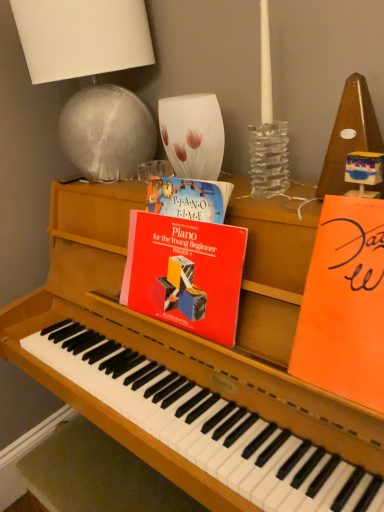
Question: Is orange matte paper at right, placed as the second paperback book when sorted from left to right, directly adjacent to white fabric lampshade at upper left?

Choices:
 (A) yes
 (B) no

Answer: (B)

Question: From a real-world perspective, is orange matte paper at right, which is counted as the 1th paperback book, starting from the right, positioned over white fabric lampshade at upper left based on gravity?

Choices:
 (A) yes
 (B) no

Answer: (B)

Question: Is orange matte paper at right, which is counted as the 1th paperback book, starting from the right, to the right of white fabric lampshade at upper left from the viewer's perspective?

Choices:
 (A) yes
 (B) no

Answer: (A)

Question: Could you tell me if orange matte paper at right, placed as the second paperback book when sorted from left to right, is turned towards white fabric lampshade at upper left?

Choices:
 (A) no
 (B) yes

Answer: (A)

Question: From the image's perspective, would you say orange matte paper at right, placed as the second paperback book when sorted from left to right, is shown under white fabric lampshade at upper left?

Choices:
 (A) no
 (B) yes

Answer: (B)

Question: From a real-world perspective, is orange matte paper at right, placed as the second paperback book when sorted from left to right, located beneath white fabric lampshade at upper left?

Choices:
 (A) yes
 (B) no

Answer: (A)

Question: Can you see orange matte paper at right, placed as the second paperback book when sorted from left to right, touching red matte piano book at center, marked as the first paperback book in a left-to-right arrangement?

Choices:
 (A) yes
 (B) no

Answer: (B)

Question: Is orange matte paper at right, which is counted as the 1th paperback book, starting from the right, not inside red matte piano book at center, which is the second paperback book in right-to-left order?

Choices:
 (A) no
 (B) yes

Answer: (B)

Question: From a real-world perspective, does orange matte paper at right, placed as the second paperback book when sorted from left to right, stand above red matte piano book at center, which is the second paperback book in right-to-left order?

Choices:
 (A) yes
 (B) no

Answer: (A)

Question: From the image's perspective, is orange matte paper at right, placed as the second paperback book when sorted from left to right, on top of red matte piano book at center, marked as the first paperback book in a left-to-right arrangement?

Choices:
 (A) no
 (B) yes

Answer: (A)

Question: Is orange matte paper at right, which is counted as the 1th paperback book, starting from the right, further to camera compared to red matte piano book at center, marked as the first paperback book in a left-to-right arrangement?

Choices:
 (A) no
 (B) yes

Answer: (A)

Question: Is orange matte paper at right, placed as the second paperback book when sorted from left to right, wider than red matte piano book at center, which is the second paperback book in right-to-left order?

Choices:
 (A) no
 (B) yes

Answer: (B)

Question: Is white fabric lampshade at upper left at the right side of orange matte paper at right, placed as the second paperback book when sorted from left to right?

Choices:
 (A) yes
 (B) no

Answer: (B)